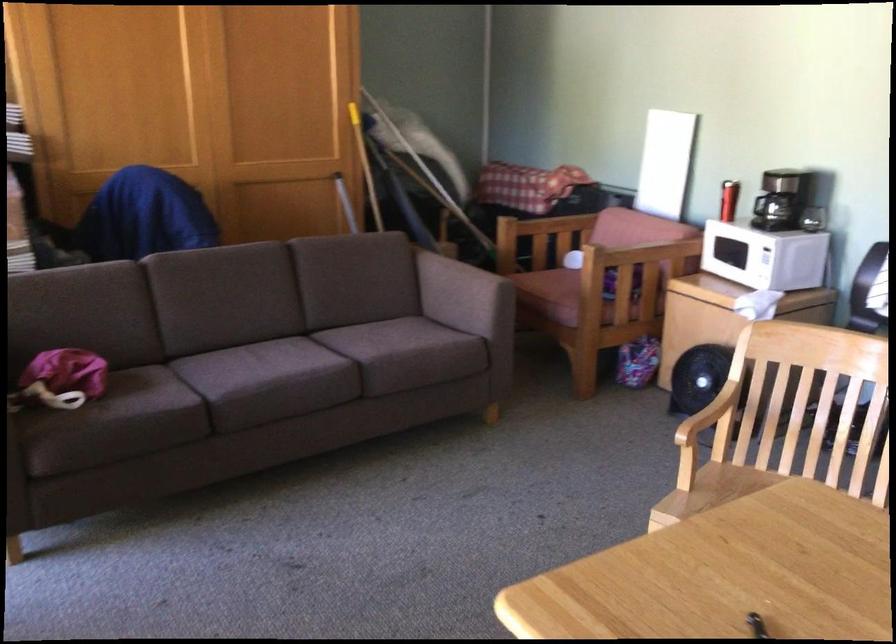
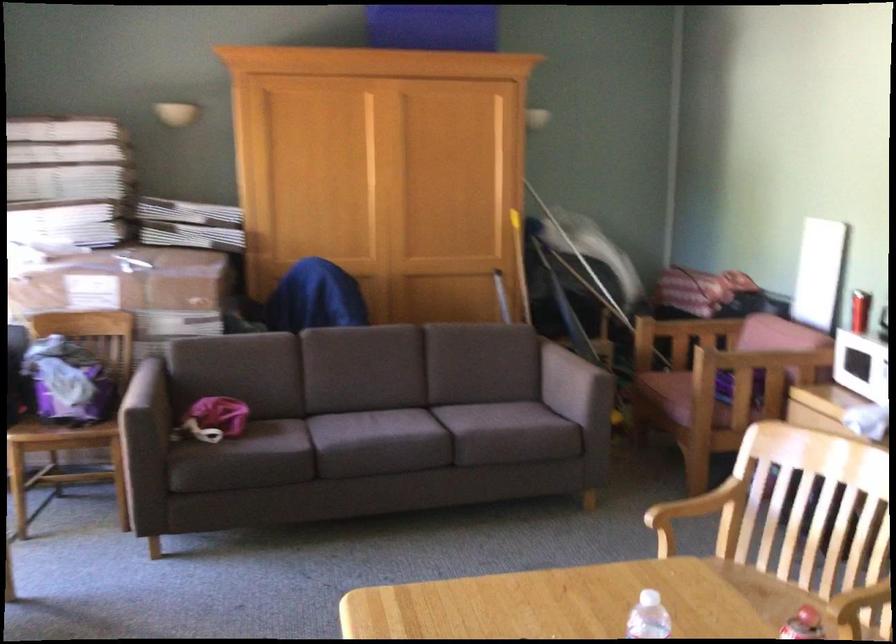
Where in the second image is the point corresponding to (372,357) from the first image?

(467, 430)